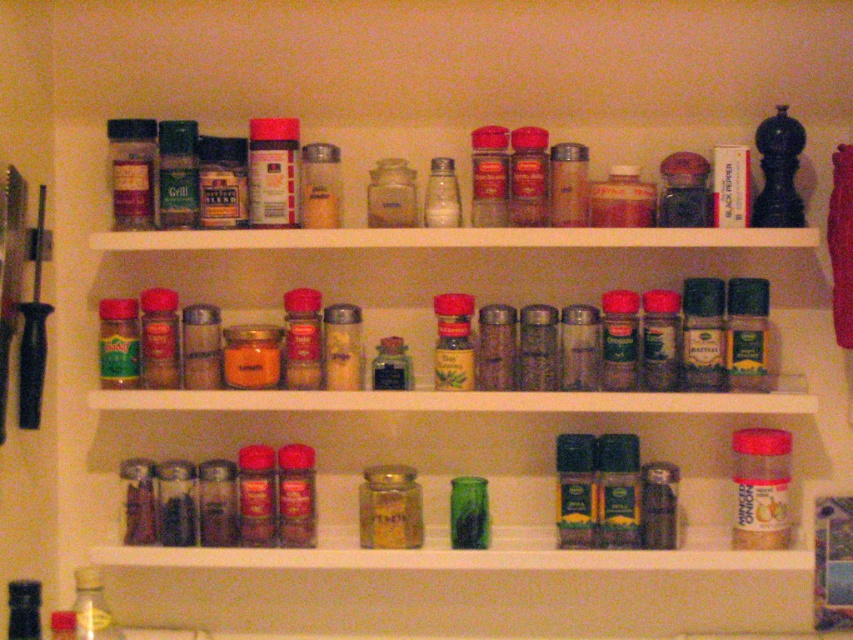
You are trying to reach for the green glass jar at lower center from the front of the spice rack. Is the translucent glass jar at center blocking your access to it?

The translucent glass jar at center is much taller than the green glass jar at lower center, so it might block your access to the green glass jar at lower center if it is positioned in front of it.

Based on the photo, you are trying to fit a new spice container that is 3 cm in diameter into the space between the translucent glass jar at center and the green glass jar at lower center. Can you determine if there is enough space based on their widths?

The translucent glass jar at center is thinner than the green glass jar at lower center, but without specific measurements of their widths or the space between them, it is impossible to determine if the 3 cm diameter container will fit.

You are trying to reach a spice container located at point (x=370, y=515) and another at point (x=86, y=566) on the spice rack. Which point is closer to you?

Point (x=370, y=515) is closer to the viewer than point (x=86, y=566), so you can reach it more easily.